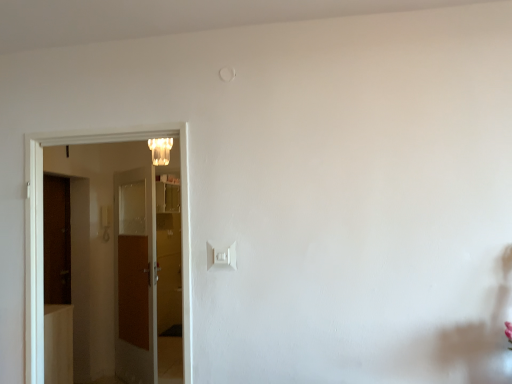
Describe the element at coordinates (42, 235) in the screenshot. I see `white wooden door at left, which is the 1th door in front-to-back order` at that location.

The image size is (512, 384). Find the location of `translucent glass chandelier at upper center`. translucent glass chandelier at upper center is located at coordinates (160, 150).

Between white plastic light switch at center and translucent glass chandelier at upper center, which one has smaller width?

white plastic light switch at center.

Identify the location of light switch to the right of translucent glass chandelier at upper center. Image resolution: width=512 pixels, height=384 pixels. (222, 256).

In terms of height, does translucent glass chandelier at upper center look taller or shorter compared to brown wooden door at left, which is counted as the 2th door, starting from the front?

Considering their sizes, translucent glass chandelier at upper center has less height than brown wooden door at left, which is counted as the 2th door, starting from the front.

From a real-world perspective, is translucent glass chandelier at upper center above or below brown wooden door at left, which is counted as the 2th door, starting from the front?

In terms of real-world spatial position, translucent glass chandelier at upper center is above brown wooden door at left, which is counted as the 2th door, starting from the front.

Would you consider translucent glass chandelier at upper center to be distant from brown wooden door at left, which is counted as the 2th door, starting from the front?

Yes.

Which is correct: translucent glass chandelier at upper center is inside brown wooden door at left, the 1th door from the back, or outside of it?

translucent glass chandelier at upper center is spatially situated outside brown wooden door at left, the 1th door from the back.

Is translucent glass chandelier at upper center facing towards white wooden door at left, which appears as the second door when viewed from the back?

No, translucent glass chandelier at upper center is not oriented towards white wooden door at left, which appears as the second door when viewed from the back.

Considering the sizes of objects translucent glass chandelier at upper center and white wooden door at left, which is the 1th door in front-to-back order, in the image provided, who is taller, translucent glass chandelier at upper center or white wooden door at left, which is the 1th door in front-to-back order,?

Standing taller between the two is white wooden door at left, which is the 1th door in front-to-back order.

Looking at this image, from a real-world perspective, does translucent glass chandelier at upper center stand above white wooden door at left, which appears as the second door when viewed from the back?

Indeed, from a real-world perspective, translucent glass chandelier at upper center stands above white wooden door at left, which appears as the second door when viewed from the back.

Considering their positions, is white wooden door at left, which is the 1th door in front-to-back order, located in front of or behind brown wooden door at left, which is counted as the 2th door, starting from the front?

white wooden door at left, which is the 1th door in front-to-back order, is positioned closer to the viewer than brown wooden door at left, which is counted as the 2th door, starting from the front.

Consider the image. How far apart are white wooden door at left, which is the 1th door in front-to-back order, and brown wooden door at left, which is counted as the 2th door, starting from the front?

white wooden door at left, which is the 1th door in front-to-back order, and brown wooden door at left, which is counted as the 2th door, starting from the front, are 4.98 feet apart.

Is white wooden door at left, which is the 1th door in front-to-back order, with brown wooden door at left, which is counted as the 2th door, starting from the front?

No, white wooden door at left, which is the 1th door in front-to-back order, is not touching brown wooden door at left, which is counted as the 2th door, starting from the front.

Is white wooden door at left, which is the 1th door in front-to-back order, taller or shorter than brown wooden door at left, the 1th door from the back?

Clearly, white wooden door at left, which is the 1th door in front-to-back order, is shorter compared to brown wooden door at left, the 1th door from the back.

Which object is closer to the camera taking this photo, white plastic light switch at center or brown wooden door at left, the 1th door from the back?

Positioned in front is white plastic light switch at center.

From the image's perspective, is white plastic light switch at center under brown wooden door at left, the 1th door from the back?

No.

Does white plastic light switch at center have a lesser height compared to brown wooden door at left, which is counted as the 2th door, starting from the front?

Indeed, white plastic light switch at center has a lesser height compared to brown wooden door at left, which is counted as the 2th door, starting from the front.

How different are the orientations of white plastic light switch at center and brown wooden door at left, which is counted as the 2th door, starting from the front, in degrees?

They differ by 42.6 degrees in their facing directions.

Is brown wooden door at left, which is counted as the 2th door, starting from the front, at the right side of white wooden door at left, which appears as the second door when viewed from the back?

Incorrect, brown wooden door at left, which is counted as the 2th door, starting from the front, is not on the right side of white wooden door at left, which appears as the second door when viewed from the back.

From a real-world perspective, which object rests below the other?

brown wooden door at left, which is counted as the 2th door, starting from the front, is physically lower.

What are the coordinates of `door on the left of white wooden door at left, which is the 1th door in front-to-back order` in the screenshot? It's located at (135, 275).

Is the position of brown wooden door at left, which is counted as the 2th door, starting from the front, more distant than that of white wooden door at left, which appears as the second door when viewed from the back?

That is True.

Is point (123, 379) in front of point (167, 161)?

No, it is behind (167, 161).

Is the surface of brown wooden door at left, which is counted as the 2th door, starting from the front, in direct contact with translucent glass chandelier at upper center?

No, brown wooden door at left, which is counted as the 2th door, starting from the front, is not touching translucent glass chandelier at upper center.

From a real-world perspective, is brown wooden door at left, the 1th door from the back, on translucent glass chandelier at upper center?

No, from a real-world perspective, brown wooden door at left, the 1th door from the back, is not over translucent glass chandelier at upper center

From the image's perspective, is brown wooden door at left, which is counted as the 2th door, starting from the front, located above or below translucent glass chandelier at upper center?

brown wooden door at left, which is counted as the 2th door, starting from the front, is below translucent glass chandelier at upper center.

At what (x,y) coordinates should I click in order to perform the action: click on lamp behind the white plastic light switch at center. Please return your answer as a coordinate pair (x, y). This screenshot has height=384, width=512. Looking at the image, I should click on (160, 150).

Find the location of a particular element. Image resolution: width=512 pixels, height=384 pixels. the 2nd door to the left of the translucent glass chandelier at upper center, counting from the anchor's position is located at coordinates (135, 275).

When comparing their distances from translucent glass chandelier at upper center, does brown wooden door at left, which is counted as the 2th door, starting from the front, or white wooden door at left, which is the 1th door in front-to-back order, seem further?

Based on the image, brown wooden door at left, which is counted as the 2th door, starting from the front, appears to be further to translucent glass chandelier at upper center.

When comparing their distances from white wooden door at left, which is the 1th door in front-to-back order, does white plastic light switch at center or brown wooden door at left, the 1th door from the back, seem closer?

white plastic light switch at center lies closer to white wooden door at left, which is the 1th door in front-to-back order, than the other object.

Which object lies nearer to the anchor point translucent glass chandelier at upper center, white plastic light switch at center or brown wooden door at left, the 1th door from the back?

The object closer to translucent glass chandelier at upper center is brown wooden door at left, the 1th door from the back.

Looking at the image, which one is located closer to brown wooden door at left, which is counted as the 2th door, starting from the front, white wooden door at left, which appears as the second door when viewed from the back, or translucent glass chandelier at upper center?

The object closer to brown wooden door at left, which is counted as the 2th door, starting from the front, is translucent glass chandelier at upper center.

From the image, which object appears to be nearer to white wooden door at left, which is the 1th door in front-to-back order, brown wooden door at left, which is counted as the 2th door, starting from the front, or white plastic light switch at center?

white plastic light switch at center is closer to white wooden door at left, which is the 1th door in front-to-back order.

Estimate the real-world distances between objects in this image. Which object is closer to white plastic light switch at center, brown wooden door at left, which is counted as the 2th door, starting from the front, or white wooden door at left, which is the 1th door in front-to-back order?

Based on the image, white wooden door at left, which is the 1th door in front-to-back order, appears to be nearer to white plastic light switch at center.

Estimate the real-world distances between objects in this image. Which object is further from white plastic light switch at center, translucent glass chandelier at upper center or brown wooden door at left, the 1th door from the back?

The object further to white plastic light switch at center is brown wooden door at left, the 1th door from the back.

Based on their spatial positions, is translucent glass chandelier at upper center or white plastic light switch at center closer to brown wooden door at left, which is counted as the 2th door, starting from the front?

The object closer to brown wooden door at left, which is counted as the 2th door, starting from the front, is translucent glass chandelier at upper center.

This screenshot has height=384, width=512. What are the coordinates of `lamp between white plastic light switch at center and brown wooden door at left, the 1th door from the back, from front to back` in the screenshot? It's located at (160, 150).

The height and width of the screenshot is (384, 512). What are the coordinates of `door between white plastic light switch at center and brown wooden door at left, the 1th door from the back, from front to back` in the screenshot? It's located at (42, 235).

Locate an element on the screen. This screenshot has height=384, width=512. lamp positioned between white wooden door at left, which is the 1th door in front-to-back order, and brown wooden door at left, the 1th door from the back, from near to far is located at coordinates (160, 150).

I want to click on door positioned between white plastic light switch at center and translucent glass chandelier at upper center from near to far, so click(x=42, y=235).